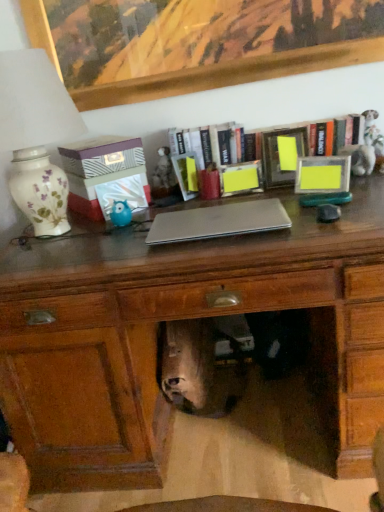
The width and height of the screenshot is (384, 512). What are the coordinates of `free space to the right of silver metallic laptop at center` in the screenshot? It's located at (316, 211).